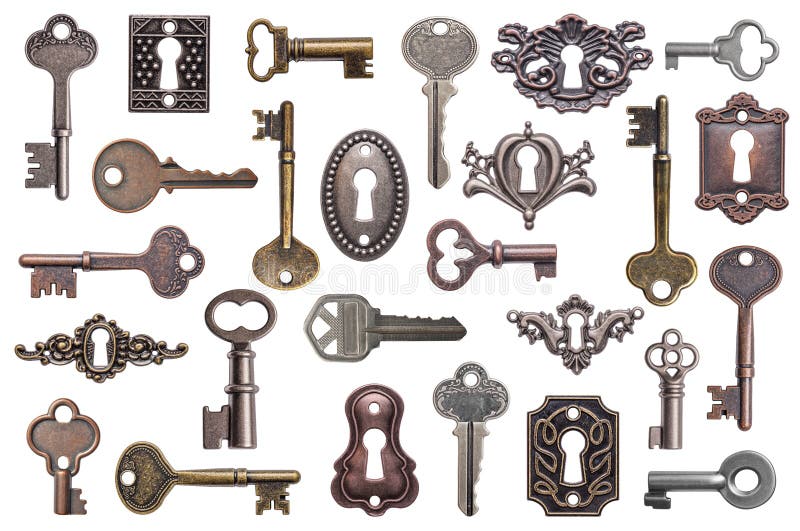
This screenshot has width=800, height=531. Identify the location of key holes. (133, 351), (186, 71), (348, 158), (380, 421), (544, 438), (561, 337), (536, 195), (594, 64), (717, 137).